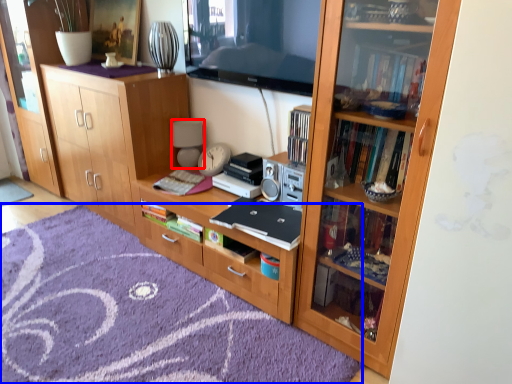
Question: Which point is closer to the camera, lamp (highlighted by a red box) or doormat (highlighted by a blue box)?

Choices:
 (A) lamp
 (B) doormat

Answer: (B)